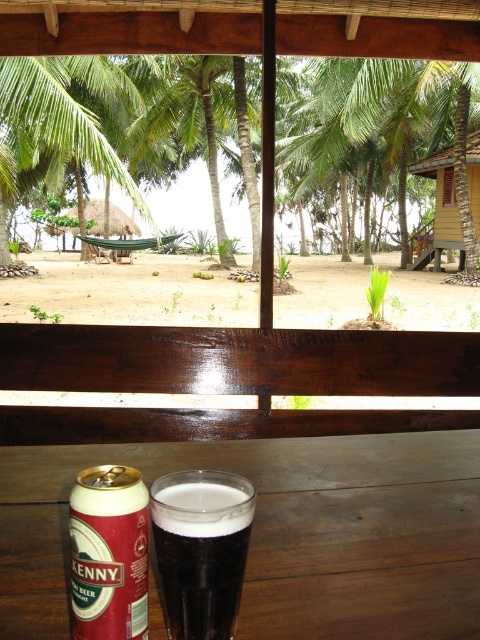
Question: Can you confirm if yellow wood hut at lower right is smaller than wooden window at center?

Choices:
 (A) yes
 (B) no

Answer: (A)

Question: Considering the real-world distances, which object is farthest from the green leafy palm tree at center?

Choices:
 (A) red matte can at lower left
 (B) wooden table at center

Answer: (A)

Question: Can you confirm if brown sandy beach at center is smaller than red matte can at lower left?

Choices:
 (A) yes
 (B) no

Answer: (B)

Question: Estimate the real-world distances between objects in this image. Which object is closer to the dark matte glass at lower center?

Choices:
 (A) green leafy palm tree at center
 (B) wooden table at center
 (C) brown sandy beach at center
 (D) red matte can at lower left

Answer: (D)

Question: Which object is positioned closest to the wooden window at center?

Choices:
 (A) yellow wood hut at lower right
 (B) wooden table at center
 (C) dark matte glass at lower center
 (D) green leafy palm tree at center

Answer: (A)

Question: Observing the image, what is the correct spatial positioning of wooden table at center in reference to brown sandy beach at center?

Choices:
 (A) left
 (B) right

Answer: (A)